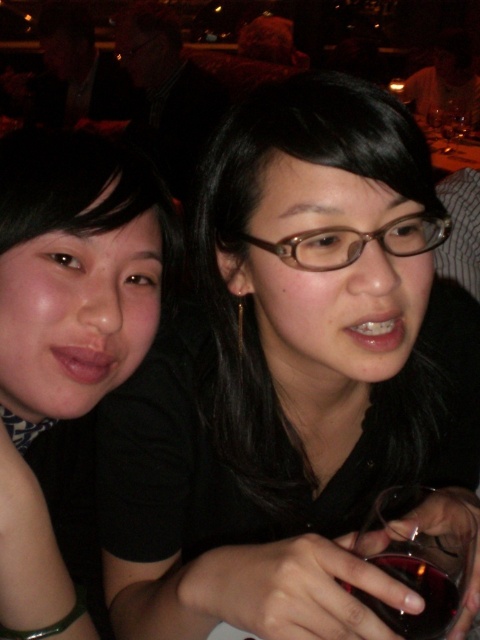
This screenshot has width=480, height=640. What do you see at coordinates (66, 333) in the screenshot?
I see `matte black hair at upper left` at bounding box center [66, 333].

Can you confirm if matte black hair at upper left is smaller than transparent glass at lower right?

No.

Is point (83, 202) farther from camera compared to point (466, 568)?

Yes, point (83, 202) is behind point (466, 568).

This screenshot has width=480, height=640. Identify the location of matte black hair at upper left. (66, 333).

Can you confirm if black matte hair at center is shorter than matte black hair at upper left?

Incorrect, black matte hair at center's height does not fall short of matte black hair at upper left's.

The width and height of the screenshot is (480, 640). In order to click on black matte hair at center in this screenshot , I will do `click(290, 376)`.

Is point (391, 419) positioned in front of point (46, 150)?

No, (391, 419) is further to viewer.

The image size is (480, 640). Identify the location of black matte hair at center. (290, 376).

Is black matte hair at center smaller than transparent glass at lower right?

No.

Is point (302, 104) farther from camera compared to point (387, 528)?

Yes, it is.

Locate an element on the screen. Image resolution: width=480 pixels, height=640 pixels. black matte hair at center is located at coordinates click(x=290, y=376).